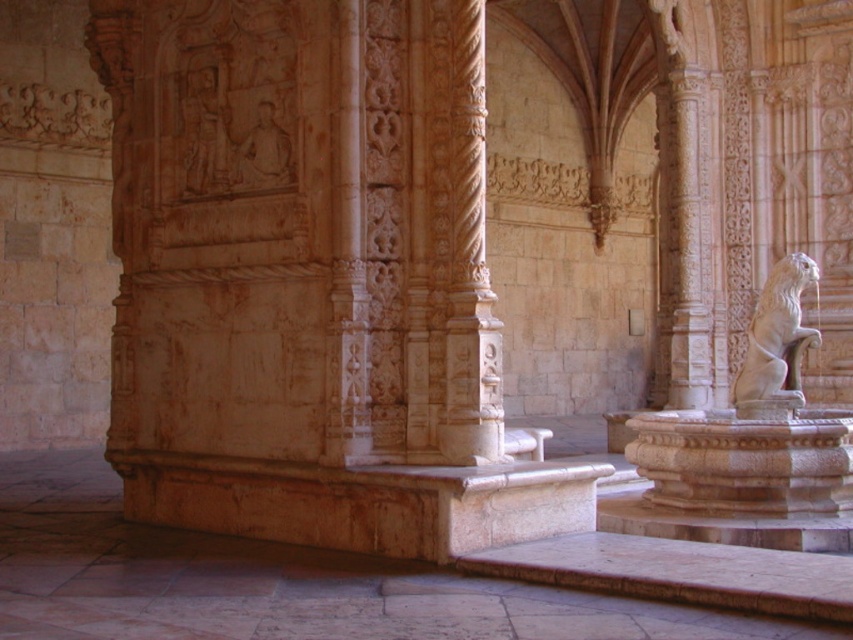
Question: Is white stone column at center thinner than white stone lion at right?

Choices:
 (A) yes
 (B) no

Answer: (A)

Question: Is white stone column at center positioned before white stone lion at right?

Choices:
 (A) no
 (B) yes

Answer: (B)

Question: Considering the real-world distances, which object is farthest from the white stone lion at right?

Choices:
 (A) carved stone column at center
 (B) white stone column at center

Answer: (A)

Question: Among these points, which one is nearest to the camera?

Choices:
 (A) (453, 220)
 (B) (755, 365)
 (C) (347, 451)

Answer: (C)

Question: In this image, where is white stone column at center located relative to white stone lion at right?

Choices:
 (A) right
 (B) left

Answer: (B)

Question: Which object appears farthest from the camera in this image?

Choices:
 (A) white stone column at center
 (B) carved stone column at center
 (C) white stone lion at right

Answer: (C)